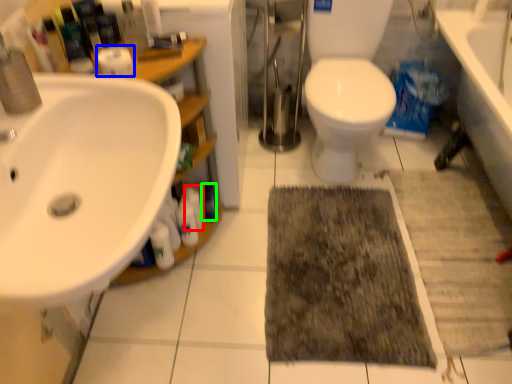
Question: Which is nearer to the toiletry (highlighted by a red box)? toilet paper (highlighted by a blue box) or toiletry (highlighted by a green box).

Choices:
 (A) toilet paper
 (B) toiletry

Answer: (B)